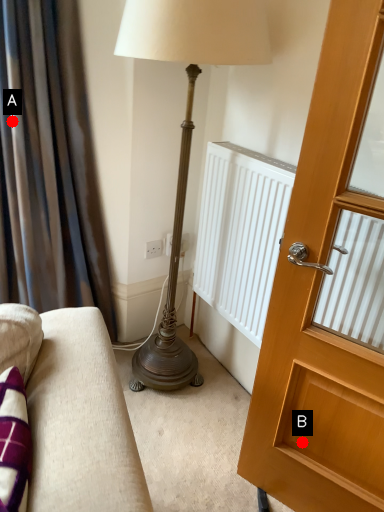
Question: Two points are circled on the image, labeled by A and B beside each circle. Which point appears farthest from the camera in this image?

Choices:
 (A) A is further
 (B) B is further

Answer: (A)